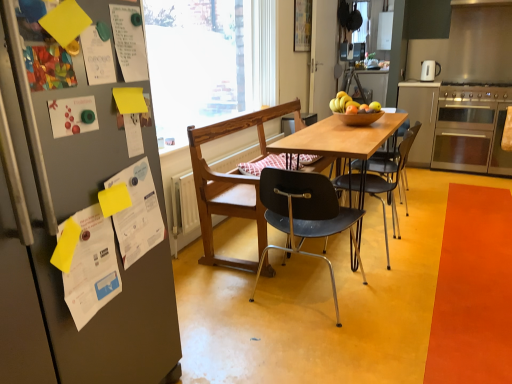
This screenshot has height=384, width=512. Find the location of `free spot in front of wooden table at center`. free spot in front of wooden table at center is located at coordinates (384, 306).